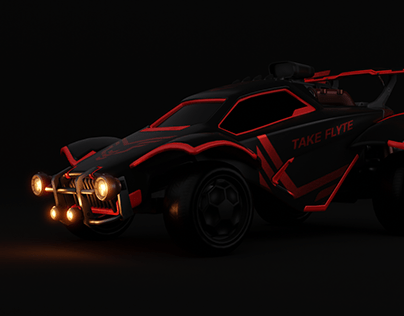
The height and width of the screenshot is (316, 404). I want to click on windows, so click(185, 115), click(271, 110).